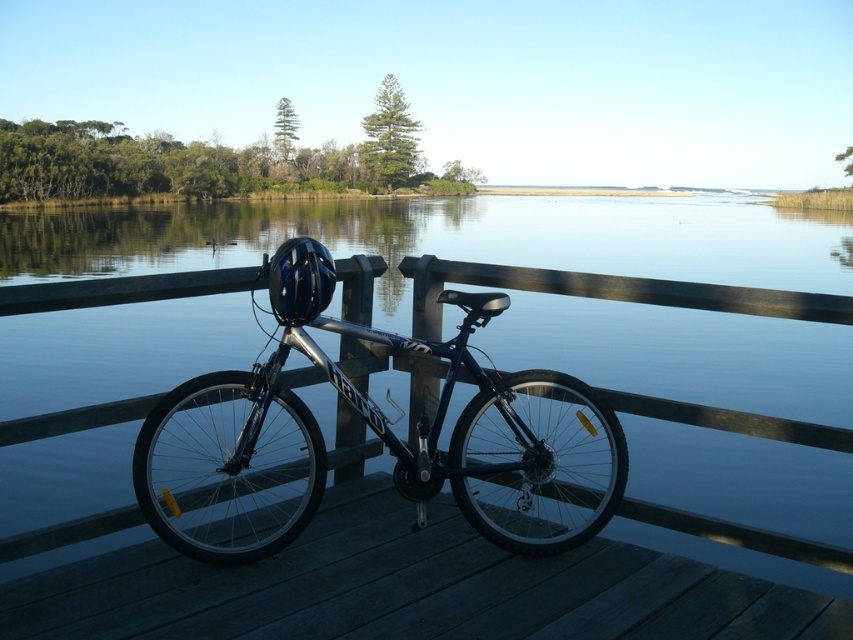
You are planning to take a photo of the dark wood dock at center and the shiny metallic bicycle at center. Since you want both objects to be clearly visible in the frame, which object should you focus on first to ensure proper focus, considering their sizes?

The dark wood dock at center is smaller than the shiny metallic bicycle at center, so you should focus on the shiny metallic bicycle at center first as it is larger and will require more detailed focus to capture clearly.

You are standing in the outdoor scene and want to take a photo of the shiny metallic bicycle at center. To avoid the transparent water at center from appearing in the photo, should you move forward or backward?

You should move forward to take the photo of the shiny metallic bicycle at center because the transparent water at center is further away from you than the bicycle, so moving closer to the bicycle would block the water from the frame.